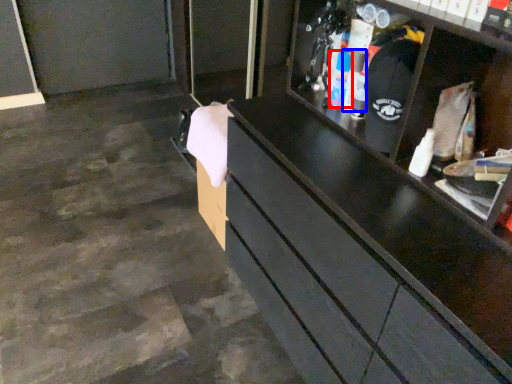
Question: Which point is further to the camera, toiletry (highlighted by a red box) or toiletry (highlighted by a blue box)?

Choices:
 (A) toiletry
 (B) toiletry

Answer: (A)